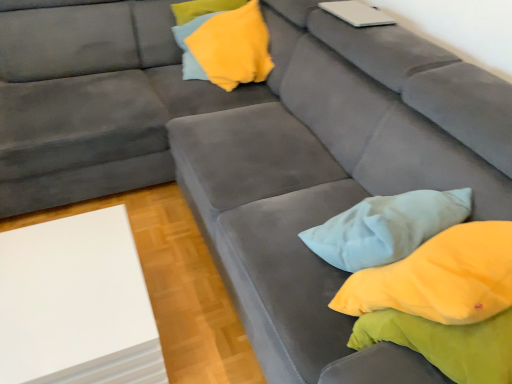
You are a GUI agent. You are given a task and a screenshot of the screen. Output one action in this format:
    pyautogui.click(x=<x>, y=<y>)
    Task: Click on the free space above white matte board at lower left (from a real-world perspective)
    This screenshot has height=384, width=512.
    Given the screenshot: What is the action you would take?
    pyautogui.click(x=62, y=283)